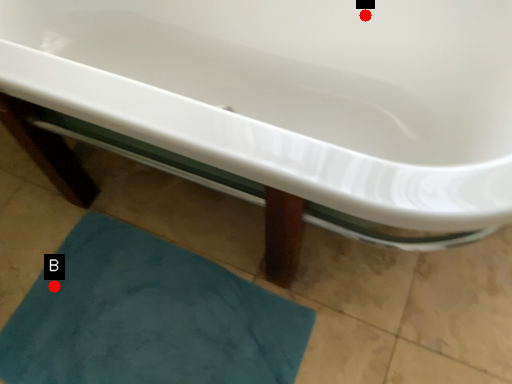
Question: Two points are circled on the image, labeled by A and B beside each circle. Which point is closer to the camera?

Choices:
 (A) A is closer
 (B) B is closer

Answer: (A)